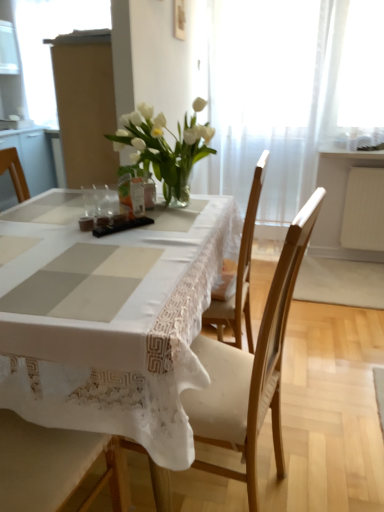
You are a GUI agent. You are given a task and a screenshot of the screen. Output one action in this format:
    pyautogui.click(x=<x>, y=<y>)
    Task: Click on the white glass vase at center
    
    Given the screenshot: What is the action you would take?
    pyautogui.click(x=165, y=147)

Where is `white lace tablecloth at center`? white lace tablecloth at center is located at coordinates (111, 321).

What is the approximate width of clear glass vase at center?

clear glass vase at center is 4.09 centimeters in width.

The width and height of the screenshot is (384, 512). Find the location of `wooden chair at center`. wooden chair at center is located at coordinates (250, 370).

Which is in front, wooden chair at center or white glass vase at center?

wooden chair at center is in front.

From a real-world perspective, which is physically below, wooden chair at center or white glass vase at center?

wooden chair at center is physically lower.

From the image's perspective, which is above, wooden chair at center or white glass vase at center?

white glass vase at center is shown above in the image.

Considering the sizes of objects wooden chair at center and white glass vase at center in the image provided, who is taller, wooden chair at center or white glass vase at center?

wooden chair at center is taller.

Does point (45, 54) appear closer or farther from the camera than point (216, 367)?

Point (45, 54) is positioned farther from the camera compared to point (216, 367).

Considering the sizes of matte cardboard box at upper left and wooden chair at center in the image, is matte cardboard box at upper left bigger or smaller than wooden chair at center?

Considering their sizes, matte cardboard box at upper left takes up more space than wooden chair at center.

From the image's perspective, is matte cardboard box at upper left located above wooden chair at center?

Yes, from the image's perspective, matte cardboard box at upper left is on top of wooden chair at center.

Considering the relative sizes of matte cardboard box at upper left and wooden chair at center in the image provided, is matte cardboard box at upper left taller than wooden chair at center?

Indeed, matte cardboard box at upper left has a greater height compared to wooden chair at center.

Is white sheer curtain at upper center bigger or smaller than white lace tablecloth at center?

In the image, white sheer curtain at upper center appears to be smaller than white lace tablecloth at center.

Consider the image. Can you confirm if white sheer curtain at upper center is thinner than white lace tablecloth at center?

Yes.

From the image's perspective, is white sheer curtain at upper center above or below white lace tablecloth at center?

white sheer curtain at upper center is situated higher than white lace tablecloth at center in the image.

Can you confirm if white sheer curtain at upper center is taller than white lace tablecloth at center?

Yes, white sheer curtain at upper center is taller than white lace tablecloth at center.

From the image's perspective, relative to clear glass vase at center, is wooden chair at center above or below?

wooden chair at center is below clear glass vase at center.

From a real-world perspective, which is physically above, wooden chair at center or clear glass vase at center?

clear glass vase at center, from a real-world perspective.

Consider the image. Is wooden chair at center in contact with clear glass vase at center?

No, wooden chair at center is not next to clear glass vase at center.

Does wooden chair at center lie behind clear glass vase at center?

No.

Consider the image. Is matte cardboard box at upper left to the left of white sheer curtain at upper center from the viewer's perspective?

Indeed, matte cardboard box at upper left is positioned on the left side of white sheer curtain at upper center.

Considering the relative sizes of matte cardboard box at upper left and white sheer curtain at upper center in the image provided, is matte cardboard box at upper left bigger than white sheer curtain at upper center?

Yes.

Is white sheer curtain at upper center located within matte cardboard box at upper left?

No, white sheer curtain at upper center is located outside of matte cardboard box at upper left.

Based on the photo, considering the sizes of matte cardboard box at upper left and white sheer curtain at upper center in the image, is matte cardboard box at upper left wider or thinner than white sheer curtain at upper center?

matte cardboard box at upper left is thinner than white sheer curtain at upper center.

Is the position of wooden chair at center less distant than that of matte cardboard box at upper left?

That is True.

From the image's perspective, between wooden chair at center and matte cardboard box at upper left, which one is located above?

matte cardboard box at upper left is shown above in the image.

From a real-world perspective, which object rests below the other?

white sheer curtain at upper center, from a real-world perspective.

Is white glass vase at center turned away from white sheer curtain at upper center?

Correct, white glass vase at center is looking away from white sheer curtain at upper center.

From the image's perspective, is white glass vase at center above or below white sheer curtain at upper center?

Based on their image positions, white glass vase at center is located beneath white sheer curtain at upper center.

Is white glass vase at center wider or thinner than white sheer curtain at upper center?

Considering their sizes, white glass vase at center looks broader than white sheer curtain at upper center.

Where is `houseplant on the left of wooden chair at center`? The width and height of the screenshot is (384, 512). houseplant on the left of wooden chair at center is located at coordinates (165, 147).

Where is `window screen that is above the wooden chair at center (from the image's perspective)`? window screen that is above the wooden chair at center (from the image's perspective) is located at coordinates (49, 45).

Which object lies nearer to the anchor point clear glass vase at center, white lace tablecloth at center or matte cardboard box at upper left?

Based on the image, white lace tablecloth at center appears to be nearer to clear glass vase at center.

Which object lies nearer to the anchor point matte cardboard box at upper left, wooden chair at center or clear glass vase at center?

clear glass vase at center is closer to matte cardboard box at upper left.

Looking at the image, which one is located closer to wooden chair at center, white lace tablecloth at center or matte cardboard box at upper left?

Among the two, white lace tablecloth at center is located nearer to wooden chair at center.

From the image, which object appears to be farther from white lace tablecloth at center, wooden chair at center or white glass vase at center?

white glass vase at center.

From the image, which object appears to be nearer to matte cardboard box at upper left, white sheer curtain at upper center or wooden chair at center?

white sheer curtain at upper center is closer to matte cardboard box at upper left.

Based on their spatial positions, is white glass vase at center or wooden chair at center closer to clear glass vase at center?

white glass vase at center lies closer to clear glass vase at center than the other object.

Estimate the real-world distances between objects in this image. Which object is closer to white sheer curtain at upper center, white glass vase at center or wooden chair at center?

The object closer to white sheer curtain at upper center is white glass vase at center.

When comparing their distances from matte cardboard box at upper left, does white lace tablecloth at center or wooden chair at center seem further?

wooden chair at center is further to matte cardboard box at upper left.

Image resolution: width=384 pixels, height=512 pixels. Find the location of `tableware located between white glass vase at center and white sheer curtain at upper center in the depth direction`. tableware located between white glass vase at center and white sheer curtain at upper center in the depth direction is located at coordinates (89, 201).

Locate an element on the screen. Image resolution: width=384 pixels, height=512 pixels. tableware positioned between wooden chair at center and matte cardboard box at upper left from near to far is located at coordinates (89, 201).

At what (x,y) coordinates should I click in order to perform the action: click on houseplant located between wooden chair at center and white sheer curtain at upper center in the depth direction. Please return your answer as a coordinate pair (x, y). Image resolution: width=384 pixels, height=512 pixels. Looking at the image, I should click on (165, 147).

The height and width of the screenshot is (512, 384). I want to click on houseplant between wooden chair at center and matte cardboard box at upper left in the front-back direction, so click(165, 147).